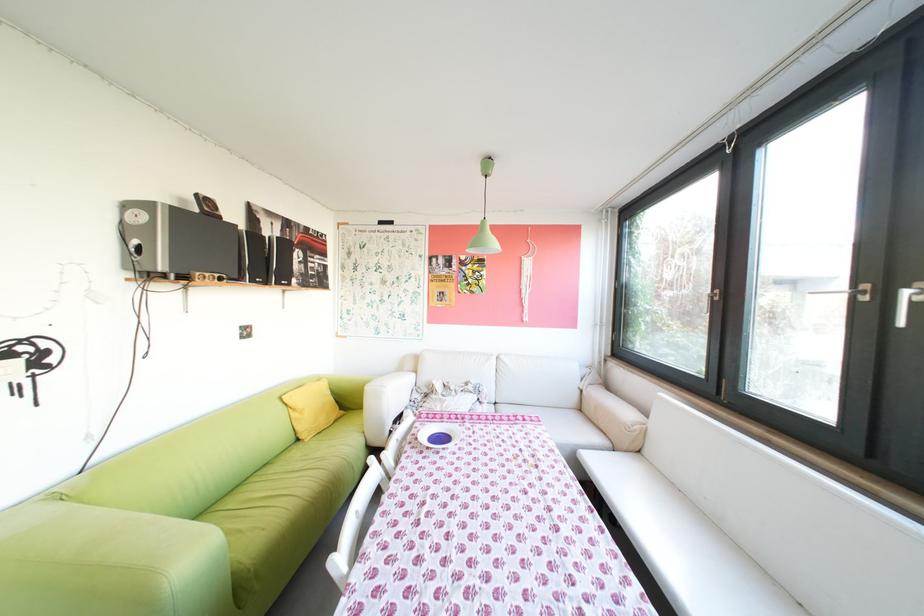
Where would you lift the yellow pillow? Please return your answer as a coordinate pair (x, y).

(310, 408)